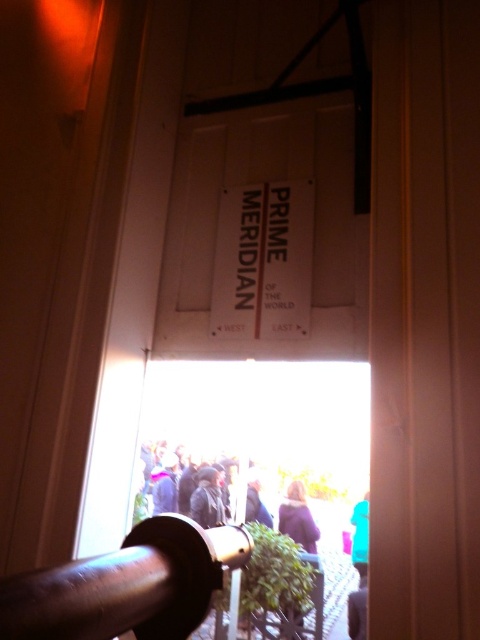
You are a photographer trying to capture the scene through the doorway. You notice the dark brown hair at center and the dark gray fabric at lower right. Which object should you focus on first if you want to ensure both are in sharp focus, considering their sizes?

The dark brown hair at center might be wider than dark gray fabric at lower right, so focusing on the larger object first would help ensure both are in sharp focus.

Looking at this image, you are standing in the room and want to move from the polished brass rail at center to the dark brown hair at center. Which direction should you move to reach it?

The polished brass rail at center is to the left of dark brown hair at center, so you should move to the right to reach it.

You are standing in the room with the sign and see the point at coordinates (127, 586). What object is this point located on?

The point at (127, 586) is located on the polished brass rail at center.